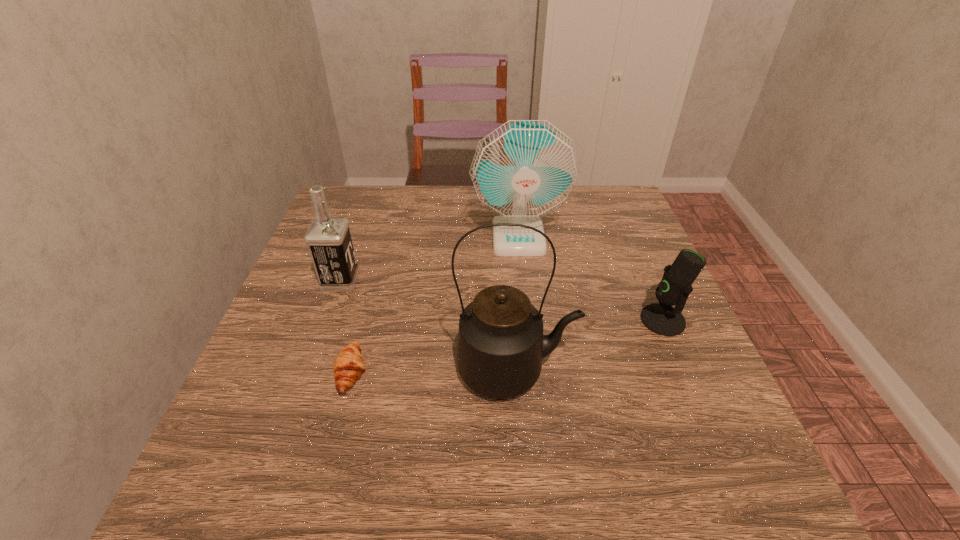
Identify the location of free space located 0.340m on the front label of the third tallest object. The width and height of the screenshot is (960, 540). (506, 281).

Locate an element on the screen. vacant region located 0.400m on the back of the third nearest object is located at coordinates (614, 206).

You are a GUI agent. You are given a task and a screenshot of the screen. Output one action in this format:
    pyautogui.click(x=<x>, y=<y>)
    Task: Click on the vacant space situated on the front-facing side of the fourth object from right to left
    The width and height of the screenshot is (960, 540).
    Given the screenshot: What is the action you would take?
    pyautogui.click(x=404, y=373)

In order to click on object located at the far edge in this screenshot , I will do [524, 169].

This screenshot has width=960, height=540. Identify the location of vodka located in the left edge section of the desktop. (328, 238).

The height and width of the screenshot is (540, 960). In order to click on pastry present at the left edge in this screenshot , I will do `click(348, 366)`.

I want to click on object present at the right edge, so click(x=661, y=318).

Find the location of a particular element. The height and width of the screenshot is (540, 960). free location at the far edge of the desktop is located at coordinates (466, 199).

Find the location of a particular element. The height and width of the screenshot is (540, 960). vacant region at the near edge of the desktop is located at coordinates (559, 470).

Locate an element on the screen. blank space at the left edge of the desktop is located at coordinates (313, 348).